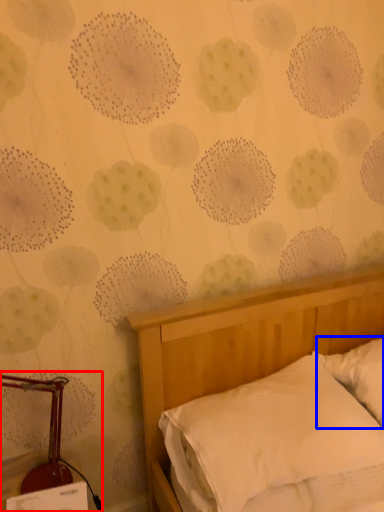
Question: Which object appears farthest to the camera in this image, bedside lamp (highlighted by a red box) or pillow (highlighted by a blue box)?

Choices:
 (A) bedside lamp
 (B) pillow

Answer: (B)